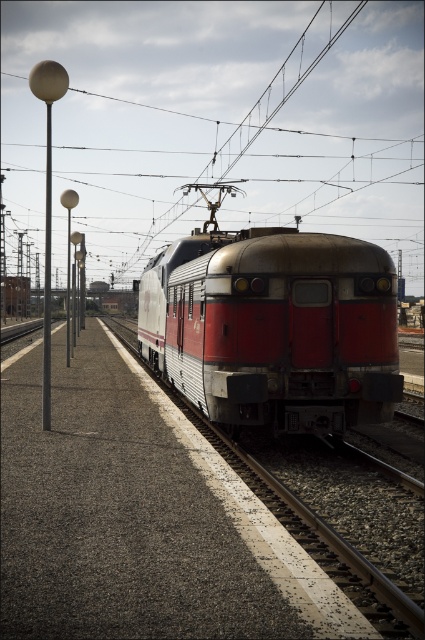
You are a station worker who needs to park a new train that is 2 meters wide. The existing silver metallic train at center is currently occupying the space. Can the new train be parked in the same spot without overlapping the metallic pole at left, considering their widths?

The silver metallic train at center is narrower than the metallic pole at left. Since the new train is 2 meters wide, and the existing train is narrower than the pole, it depends on the pole width. But since the pole is wider than the train, the pole might not block parking. Wait, the description says the train is less than the pole in width. So if the pole is wider, the train is narrower. The new train is 2m. If the pole is wider than 2m, then maybe? Hmm, the question is unclear. Maybe better to rephrase.

You are a maintenance worker who needs to reach the metallic pole at left from the silver metallic train at center. The safety regulations state that you must stay within 10 meters of the train at all times. Can you safely walk to the pole without violating the rule?

The distance between the silver metallic train at center and the metallic pole at left is 9.36 meters, which is under the 10 meters limit. Therefore, you can safely walk to the pole without violating the safety regulations.

You are a passenger waiting at the station. You see the silver metallic train at center and the metallic pole at left. Which object is closer to you?

The silver metallic train at center is closer to you because it is positioned under the metallic pole at left, indicating it is in front of the pole.